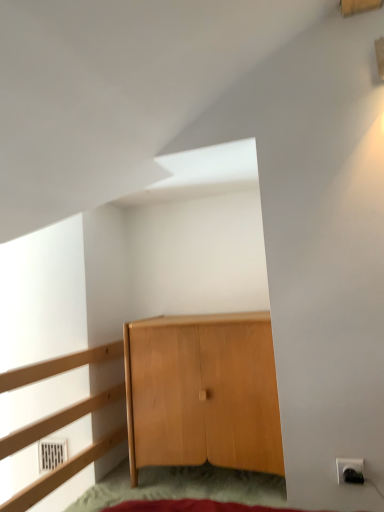
Question: Is light brown wood cabinet at center closer to the viewer compared to light wood dresser at left?

Choices:
 (A) yes
 (B) no

Answer: (B)

Question: Can light wood dresser at left be found inside light brown wood cabinet at center?

Choices:
 (A) yes
 (B) no

Answer: (B)

Question: From a real-world perspective, is light brown wood cabinet at center over light wood dresser at left?

Choices:
 (A) no
 (B) yes

Answer: (A)

Question: Is light brown wood cabinet at center bigger than light wood dresser at left?

Choices:
 (A) no
 (B) yes

Answer: (A)

Question: From the image's perspective, is light brown wood cabinet at center on top of light wood dresser at left?

Choices:
 (A) no
 (B) yes

Answer: (A)

Question: Is light brown wood cabinet at center smaller than light wood dresser at left?

Choices:
 (A) yes
 (B) no

Answer: (A)

Question: Could light wood dresser at left be considered to be inside white plastic electric outlet at lower right?

Choices:
 (A) no
 (B) yes

Answer: (A)

Question: Is white plastic electric outlet at lower right oriented away from light wood dresser at left?

Choices:
 (A) yes
 (B) no

Answer: (B)

Question: Is white plastic electric outlet at lower right to the right of light wood dresser at left from the viewer's perspective?

Choices:
 (A) no
 (B) yes

Answer: (B)

Question: Does white plastic electric outlet at lower right have a lesser height compared to light wood dresser at left?

Choices:
 (A) yes
 (B) no

Answer: (A)

Question: Considering the relative sizes of white plastic electric outlet at lower right and light wood dresser at left in the image provided, is white plastic electric outlet at lower right taller than light wood dresser at left?

Choices:
 (A) yes
 (B) no

Answer: (B)

Question: Can you confirm if white plastic electric outlet at lower right is bigger than light wood dresser at left?

Choices:
 (A) no
 (B) yes

Answer: (A)

Question: Considering the relative sizes of light wood dresser at left and light brown wood cabinet at center in the image provided, is light wood dresser at left bigger than light brown wood cabinet at center?

Choices:
 (A) no
 (B) yes

Answer: (B)